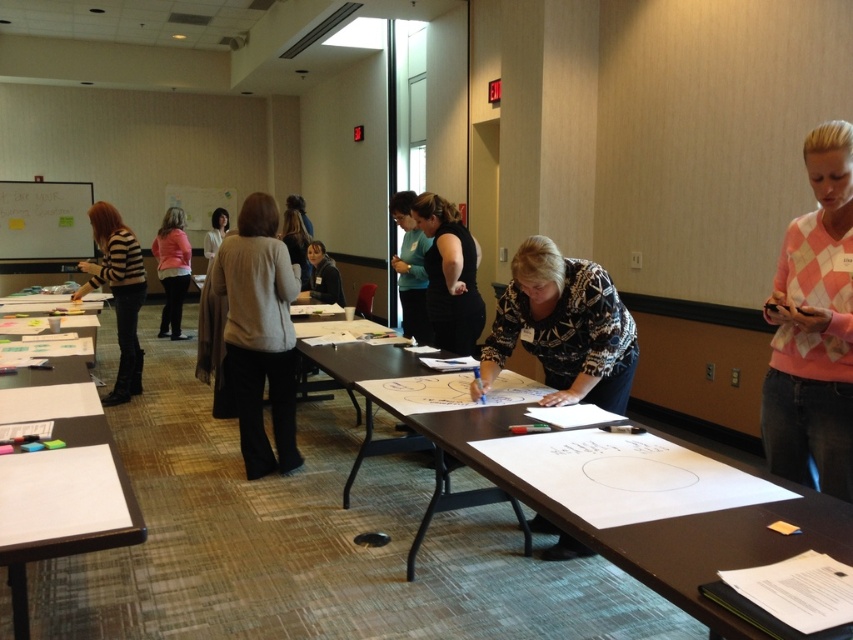
Which of these two, black matte dress at center or light pink sweater at center, stands shorter?

black matte dress at center is shorter.

Between black matte dress at center and light pink sweater at center, which one appears on the right side from the viewer's perspective?

black matte dress at center is more to the right.

Which is behind, point (436, 289) or point (169, 298)?

The point (169, 298) is behind.

Where is `black matte dress at center`? black matte dress at center is located at coordinates (450, 275).

Can you confirm if striped sweater at left is bigger than white paper at lower left?

Indeed, striped sweater at left has a larger size compared to white paper at lower left.

Is striped sweater at left in front of white paper at lower left?

No, striped sweater at left is behind white paper at lower left.

Where is `striped sweater at left`? Image resolution: width=853 pixels, height=640 pixels. striped sweater at left is located at coordinates (119, 292).

Looking at this image, does whiteboard at upper left have a greater width compared to light pink sweater at center?

Yes, whiteboard at upper left is wider than light pink sweater at center.

Identify the location of whiteboard at upper left. (44, 220).

Locate an element on the screen. whiteboard at upper left is located at coordinates click(44, 220).